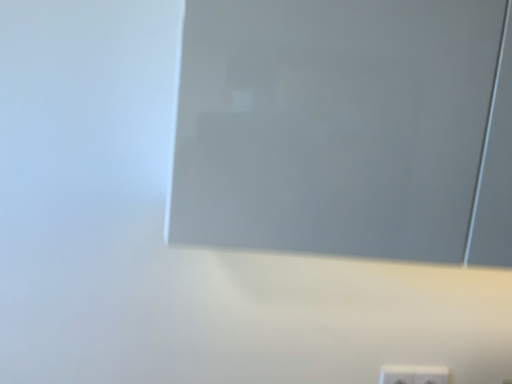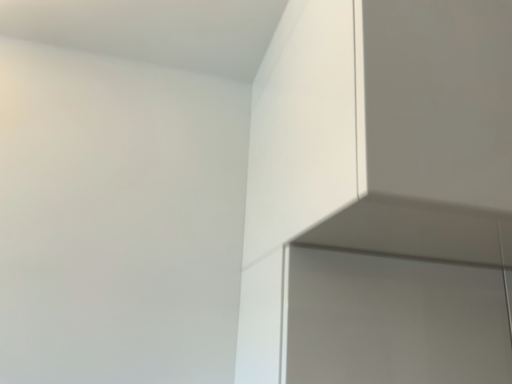
Question: How did the camera likely rotate when shooting the video?

Choices:
 (A) rotated left
 (B) rotated right

Answer: (B)